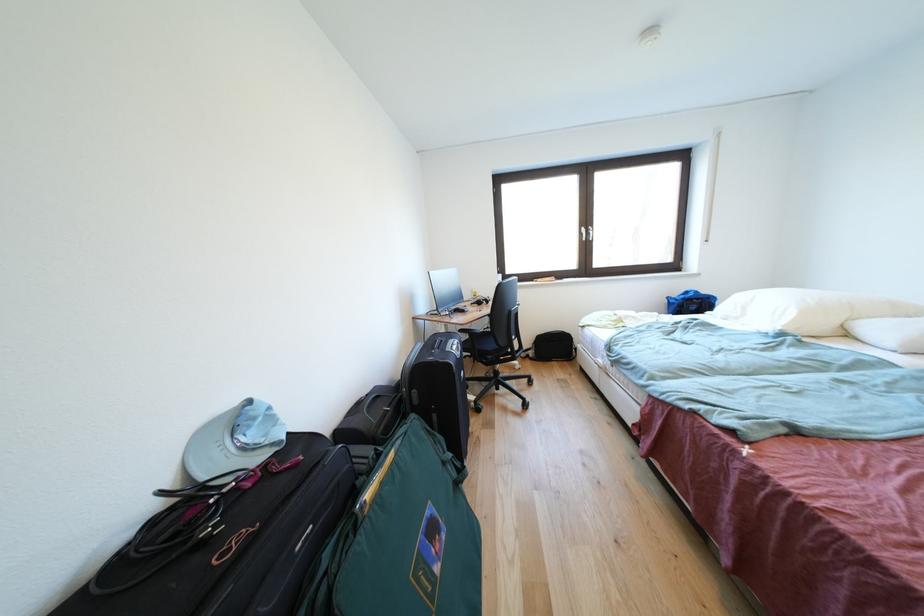
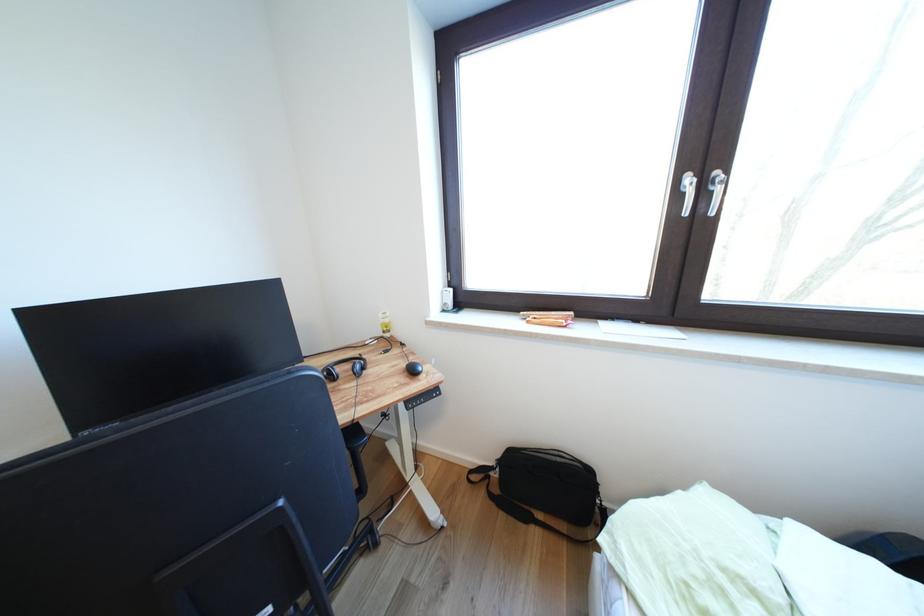
In a continuous first-person perspective shot, in which direction is the camera moving?

The movement direction of the cameraman is right, forward.